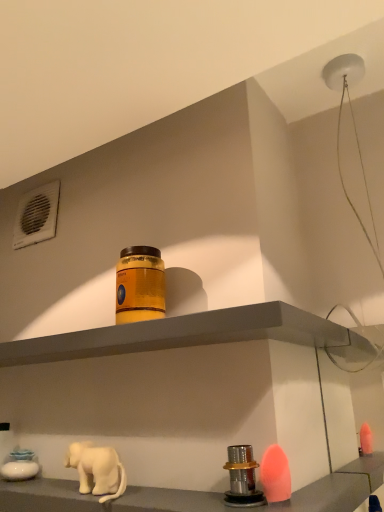
Question: Is white matte elephant at lower left taller or shorter than matte gray shelf at center, acting as the second shelf starting from the bottom?

Choices:
 (A) short
 (B) tall

Answer: (B)

Question: Considering the positions of white matte elephant at lower left and matte gray shelf at center, acting as the second shelf starting from the bottom, in the image, is white matte elephant at lower left bigger or smaller than matte gray shelf at center, acting as the second shelf starting from the bottom,?

Choices:
 (A) small
 (B) big

Answer: (A)

Question: Estimate the real-world distances between objects in this image. Which object is closer to the white matte elephant at lower left?

Choices:
 (A) orange matte jar at center
 (B) matte gray shelf at center, the 1th shelf when ordered from top to bottom
 (C) metallic silver knob at lower center, which appears as the first shelf when ordered from the bottom

Answer: (C)

Question: Which is nearer to the orange matte jar at center?

Choices:
 (A) metallic silver knob at lower center, which appears as the first shelf when ordered from the bottom
 (B) white matte elephant at lower left
 (C) matte gray shelf at center, acting as the second shelf starting from the bottom

Answer: (C)